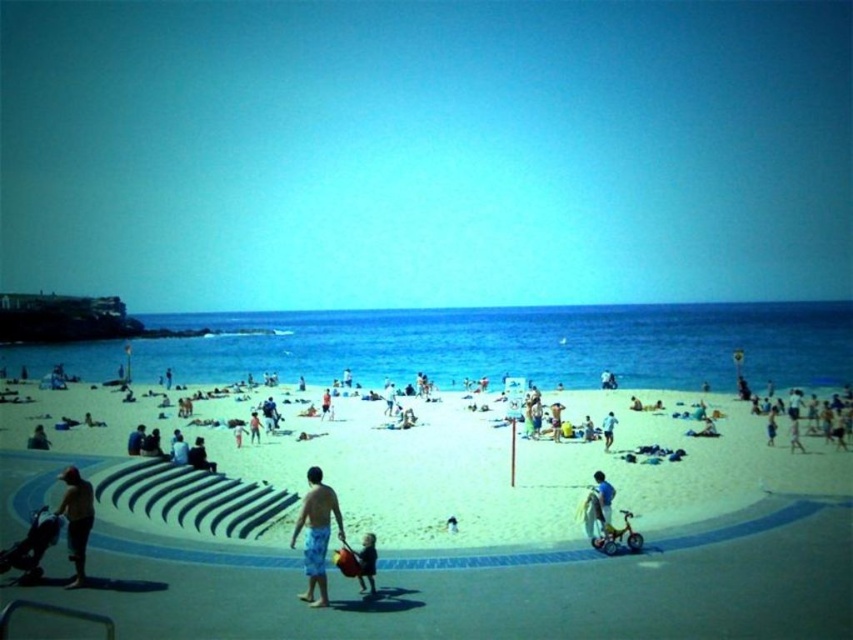
Question: Which point is farther from the camera taking this photo?

Choices:
 (A) (195, 452)
 (B) (598, 515)
 (C) (38, 426)

Answer: (C)

Question: Is blue striped shorts at center closer to camera compared to smooth skin person at lower left?

Choices:
 (A) no
 (B) yes

Answer: (B)

Question: Is white sand at center closer to camera compared to smooth tan skin at lower left?

Choices:
 (A) yes
 (B) no

Answer: (A)

Question: Can you confirm if tan fabric bag at center is thinner than smooth skin person at lower left?

Choices:
 (A) no
 (B) yes

Answer: (B)

Question: Among these objects, which one is nearest to the camera?

Choices:
 (A) matte black shorts at lower left
 (B) blue striped shorts at center
 (C) smooth skin person at lower left

Answer: (B)

Question: Based on their relative distances, which object is farther from the white sand at center?

Choices:
 (A) blue striped shorts at center
 (B) light blue fabric at center
 (C) matte black shorts at lower left
 (D) smooth tan skin at lower left

Answer: (A)